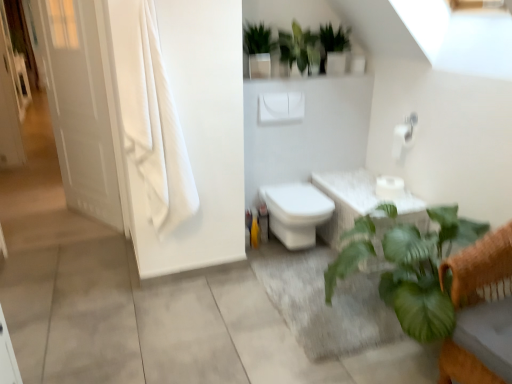
Image resolution: width=512 pixels, height=384 pixels. Describe the element at coordinates (258, 49) in the screenshot. I see `green matte plant at upper center, which appears as the third vegetation when viewed from the right` at that location.

Measure the distance between point (330, 47) and camera.

Point (330, 47) is 9.59 feet away from camera.

This screenshot has height=384, width=512. I want to click on green matte plant at upper center, which is the 1th vegetation from right to left, so click(334, 38).

This screenshot has height=384, width=512. I want to click on white fabric curtain at left, so click(x=151, y=115).

Find the location of `green leafy plant at lower right`. green leafy plant at lower right is located at coordinates (349, 202).

Measure the distance between white glossy toilet at center and camera.

white glossy toilet at center is 8.91 feet from camera.

Measure the distance between white matte toilet paper at upper right, the 2th toilet paper ordered from the bottom, and camera.

The depth of white matte toilet paper at upper right, the 2th toilet paper ordered from the bottom, is 2.81 meters.

I want to click on green leafy plant at lower right, so click(x=481, y=312).

Does point (307, 39) appear closer or farther from the camera than point (259, 33)?

Clearly, point (307, 39) is more distant from the camera than point (259, 33).

In the scene shown: Is green matte plant at upper center, acting as the 1th vegetation starting from the left, completely or partially inside green glossy plant at upper center, which is the 2th vegetation in right-to-left order?

Definitely not — green matte plant at upper center, acting as the 1th vegetation starting from the left, is not inside green glossy plant at upper center, which is the 2th vegetation in right-to-left order.

In order to click on vegetation above the green glossy plant at upper center, which appears as the second vegetation when viewed from the left (from a real-world perspective) in this screenshot , I will do `click(258, 49)`.

Which object is closer to the camera taking this photo, green glossy plant at upper center, which appears as the second vegetation when viewed from the left, or green matte plant at upper center, acting as the 1th vegetation starting from the left?

green matte plant at upper center, acting as the 1th vegetation starting from the left, is more forward.

In the image, there is a green matte plant at upper center, which appears as the third vegetation when viewed from the right. Where is `houseplant below it (from the image's perspective)`? The image size is (512, 384). houseplant below it (from the image's perspective) is located at coordinates (424, 273).

From a real-world perspective, which is physically below, green matte plant at upper center, acting as the 1th vegetation starting from the left, or green leafy plant at lower right?

green leafy plant at lower right.

Which is more to the left, green matte plant at upper center, acting as the 1th vegetation starting from the left, or green leafy plant at lower right?

green matte plant at upper center, acting as the 1th vegetation starting from the left.

Does green matte plant at upper center, the third vegetation positioned from the left, have a smaller size compared to green leafy plant at lower right?

Indeed, green matte plant at upper center, the third vegetation positioned from the left, has a smaller size compared to green leafy plant at lower right.

Which of these two, green matte plant at upper center, the third vegetation positioned from the left, or green leafy plant at lower right, is wider?

With larger width is green leafy plant at lower right.

Which of these two, green matte plant at upper center, which is the 1th vegetation from right to left, or green leafy plant at lower right, stands taller?

green leafy plant at lower right is taller.

Would you say green matte plant at upper center, the third vegetation positioned from the left, is outside green leafy plant at lower right?

That's correct, green matte plant at upper center, the third vegetation positioned from the left, is outside of green leafy plant at lower right.

In terms of width, does white matte toilet paper at upper right, the 1th toilet paper from the top, look wider or thinner when compared to green leafy plant at lower right?

Clearly, white matte toilet paper at upper right, the 1th toilet paper from the top, has less width compared to green leafy plant at lower right.

How distant is white matte toilet paper at upper right, the 2th toilet paper ordered from the bottom, from green leafy plant at lower right?

They are 19.29 inches apart.

Consider the image. From the image's perspective, which is below, white matte toilet paper at upper right, the 2th toilet paper ordered from the bottom, or green leafy plant at lower right?

green leafy plant at lower right is shown below in the image.

Does white matte toilet paper at upper right, the 1th toilet paper from the top, have a smaller size compared to green leafy plant at lower right?

Yes.

Is green leafy plant at lower right smaller than green glossy plant at upper center, which is the 2th vegetation in right-to-left order?

Incorrect, green leafy plant at lower right is not smaller in size than green glossy plant at upper center, which is the 2th vegetation in right-to-left order.

Considering the relative sizes of green leafy plant at lower right and green glossy plant at upper center, which appears as the second vegetation when viewed from the left, in the image provided, is green leafy plant at lower right shorter than green glossy plant at upper center, which appears as the second vegetation when viewed from the left,?

No, green leafy plant at lower right is not shorter than green glossy plant at upper center, which appears as the second vegetation when viewed from the left.

Does green leafy plant at lower right turn towards green glossy plant at upper center, which is the 2th vegetation in right-to-left order?

No, green leafy plant at lower right is not oriented towards green glossy plant at upper center, which is the 2th vegetation in right-to-left order.

Relative to green glossy plant at upper center, which is the 2th vegetation in right-to-left order, is green leafy plant at lower right in front or behind?

Visually, green leafy plant at lower right is located in front of green glossy plant at upper center, which is the 2th vegetation in right-to-left order.

Considering the sizes of green matte plant at upper center, which is the 1th vegetation from right to left, and white glossy toilet at center in the image, is green matte plant at upper center, which is the 1th vegetation from right to left, wider or thinner than white glossy toilet at center?

In the image, green matte plant at upper center, which is the 1th vegetation from right to left, appears to be more narrow than white glossy toilet at center.

From the image's perspective, would you say green matte plant at upper center, which is the 1th vegetation from right to left, is positioned over white glossy toilet at center?

Yes.

Consider the image. Is green matte plant at upper center, the third vegetation positioned from the left, in contact with white glossy toilet at center?

No, green matte plant at upper center, the third vegetation positioned from the left, is not beside white glossy toilet at center.

Is green matte plant at upper center, the third vegetation positioned from the left, facing away from white glossy toilet at center?

No, green matte plant at upper center, the third vegetation positioned from the left, is not facing away from white glossy toilet at center.

Considering the sizes of objects white glossy door at left and green leafy plant at lower right in the image provided, who is taller, white glossy door at left or green leafy plant at lower right?

white glossy door at left.

Where is `houseplant on the right of white glossy door at left`? Image resolution: width=512 pixels, height=384 pixels. houseplant on the right of white glossy door at left is located at coordinates (424, 273).

Based on the photo, can you tell me how much white glossy door at left and green leafy plant at lower right differ in facing direction?

They differ by 31.9 degrees in their facing directions.

Which object is more forward, white glossy door at left or green leafy plant at lower right?

green leafy plant at lower right.

Find the location of a particular element. This screenshot has width=512, height=384. vegetation that is the 1st one below the green matte plant at upper center, which appears as the third vegetation when viewed from the right (from a real-world perspective) is located at coordinates (298, 47).

The width and height of the screenshot is (512, 384). Identify the location of the 1st vegetation behind the green leafy plant at lower right. (258, 49).

Based on their spatial positions, is white matte toilet paper at upper right, the 2th toilet paper ordered from the bottom, or green leafy plant at lower right closer to green matte plant at upper center, which is the 1th vegetation from right to left?

Based on the image, white matte toilet paper at upper right, the 2th toilet paper ordered from the bottom, appears to be nearer to green matte plant at upper center, which is the 1th vegetation from right to left.

When comparing their distances from green leafy plant at lower right, does green leafy plant at lower right or green matte plant at upper center, the third vegetation positioned from the left, seem further?

Among the two, green matte plant at upper center, the third vegetation positioned from the left, is located further to green leafy plant at lower right.

Looking at the image, which one is located further to green leafy plant at lower right, green leafy plant at lower right or white matte toilet paper at upper right, the 1th toilet paper from the top?

white matte toilet paper at upper right, the 1th toilet paper from the top.

From the image, which object appears to be farther from white glossy door at left, green matte plant at upper center, the third vegetation positioned from the left, or green leafy plant at lower right?

The object further to white glossy door at left is green leafy plant at lower right.

When comparing their distances from green matte plant at upper center, the third vegetation positioned from the left, does white matte toilet paper at upper right, the 2th toilet paper ordered from the bottom, or white matte toilet paper at center, the second toilet paper viewed from the top, seem closer?

white matte toilet paper at upper right, the 2th toilet paper ordered from the bottom.

Looking at the image, which one is located closer to green matte plant at upper center, acting as the 1th vegetation starting from the left, white matte toilet paper at center, the first toilet paper ordered from the bottom, or green leafy plant at lower right?

The object closer to green matte plant at upper center, acting as the 1th vegetation starting from the left, is white matte toilet paper at center, the first toilet paper ordered from the bottom.

Looking at the image, which one is located closer to white matte toilet paper at upper right, the 1th toilet paper from the top, green matte plant at upper center, acting as the 1th vegetation starting from the left, or green leafy plant at lower right?

green leafy plant at lower right is closer to white matte toilet paper at upper right, the 1th toilet paper from the top.

Looking at this image, looking at the image, which one is located further to green matte plant at upper center, which is the 1th vegetation from right to left, white fabric curtain at left or white glossy door at left?

Based on the image, white glossy door at left appears to be further to green matte plant at upper center, which is the 1th vegetation from right to left.

This screenshot has height=384, width=512. In order to click on houseplant between white fabric curtain at left and white matte toilet paper at upper right, the 2th toilet paper ordered from the bottom in this screenshot , I will do `click(424, 273)`.

This screenshot has height=384, width=512. What are the coordinates of `houseplant between white fabric curtain at left and white matte toilet paper at center, the first toilet paper ordered from the bottom, from left to right` in the screenshot? It's located at (424, 273).

Locate an element on the screen. This screenshot has height=384, width=512. vegetation between green matte plant at upper center, acting as the 1th vegetation starting from the left, and green matte plant at upper center, the third vegetation positioned from the left, from left to right is located at coordinates (298, 47).

Where is `bath located between green leafy plant at lower right and green matte plant at upper center, acting as the 1th vegetation starting from the left, in the depth direction`? bath located between green leafy plant at lower right and green matte plant at upper center, acting as the 1th vegetation starting from the left, in the depth direction is located at coordinates (349, 202).